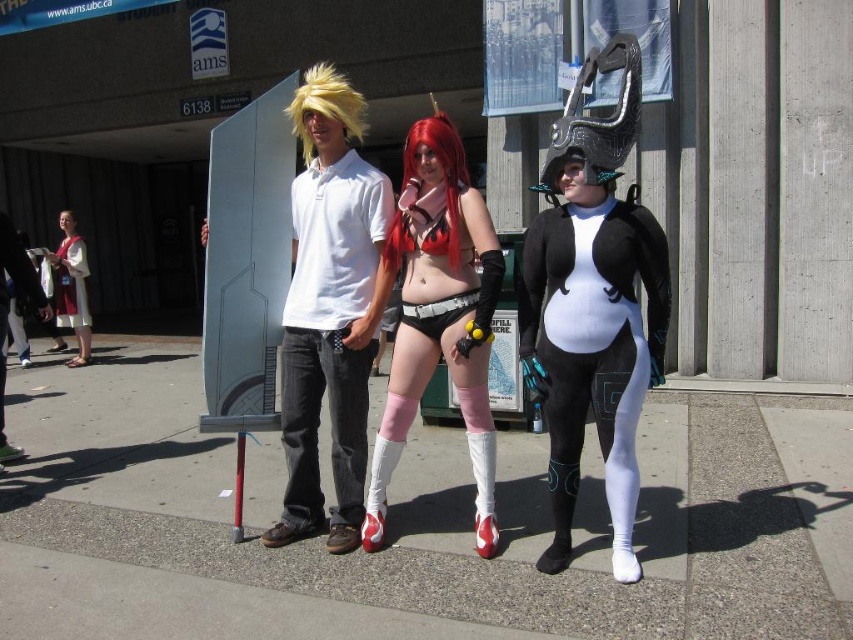
Does matte black and white bodysuit at center have a greater height compared to matte black shorts at center?

Yes.

Is point (601, 204) closer to camera compared to point (364, 525)?

That is True.

Identify the location of matte black and white bodysuit at center. The image size is (853, 640). (592, 305).

Which of these two, matte white dress at left or blonde synthetic wig at center, stands taller?

Standing taller between the two is matte white dress at left.

Who is shorter, matte white dress at left or blonde synthetic wig at center?

blonde synthetic wig at center

This screenshot has height=640, width=853. What are the coordinates of `matte white dress at left` in the screenshot? It's located at coord(71,288).

This screenshot has height=640, width=853. I want to click on matte white dress at left, so click(71, 288).

Between shiny red wig at center and matte white robe at center, which one is positioned lower?

matte white robe at center is below.

Between shiny red wig at center and matte white robe at center, which one is positioned higher?

shiny red wig at center is higher up.

This screenshot has height=640, width=853. Identify the location of shiny red wig at center. (440, 164).